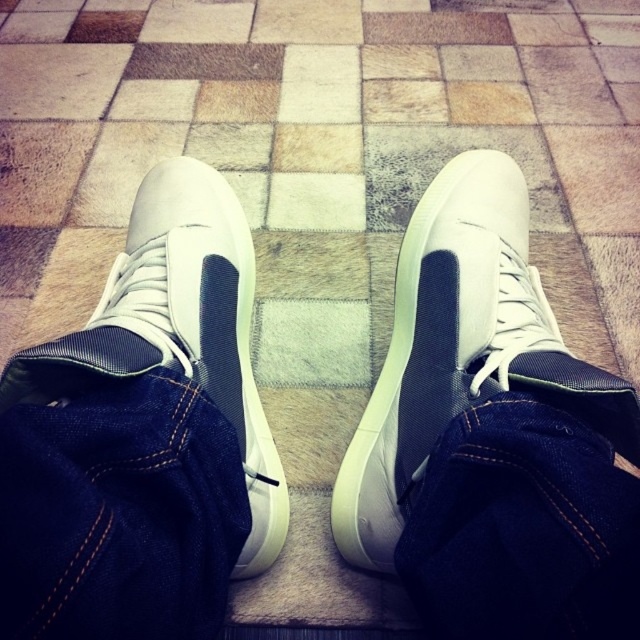
Question: Estimate the real-world distances between objects in this image. Which object is closer to the dark blue denim jeans at center?

Choices:
 (A) white matte/suede sneaker at center
 (B) denim at center

Answer: (B)

Question: Is white leather sneaker at center bigger than white matte/suede sneaker at center?

Choices:
 (A) no
 (B) yes

Answer: (A)

Question: Considering the real-world distances, which object is closest to the white matte/suede sneaker at center?

Choices:
 (A) denim at center
 (B) white leather sneaker at center
 (C) dark blue denim jeans at center

Answer: (A)

Question: Among these points, which one is farthest from the camera?

Choices:
 (A) (497, 538)
 (B) (576, 408)
 (C) (144, 282)

Answer: (C)

Question: Does denim at center appear on the right side of white leather sneaker at center?

Choices:
 (A) no
 (B) yes

Answer: (A)

Question: In this image, where is dark blue denim jeans at center located relative to white matte/suede sneaker at center?

Choices:
 (A) right
 (B) left

Answer: (A)